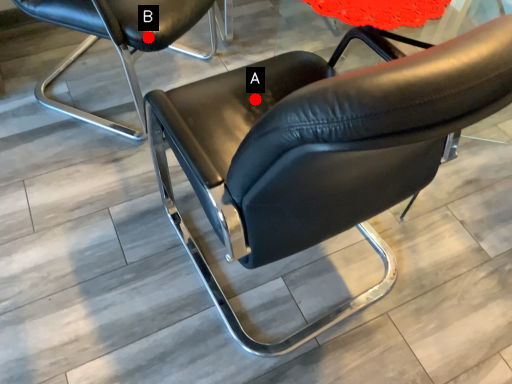
Question: Two points are circled on the image, labeled by A and B beside each circle. Which of the following is the closest to the observer?

Choices:
 (A) A is closer
 (B) B is closer

Answer: (A)